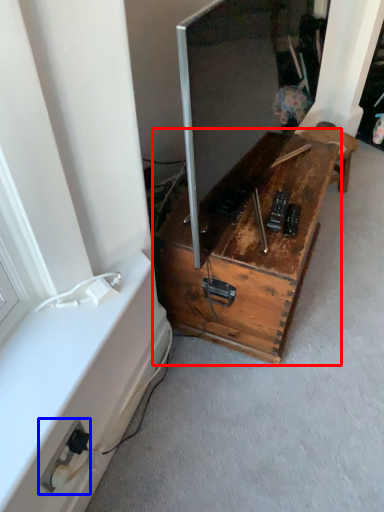
Question: Which point is further to the camera, furniture (highlighted by a red box) or electric outlet (highlighted by a blue box)?

Choices:
 (A) furniture
 (B) electric outlet

Answer: (A)